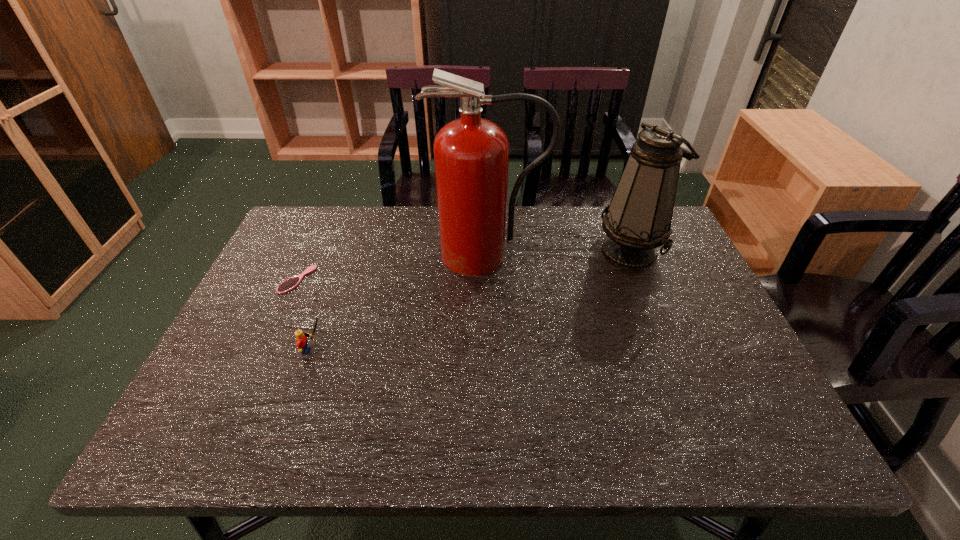
The height and width of the screenshot is (540, 960). Find the location of `vacant space that satisfies the following two spatial constraints: 1. with the handle and nozzle on the fire extinguisher; 2. on the front-facing side of the third tallest object`. vacant space that satisfies the following two spatial constraints: 1. with the handle and nozzle on the fire extinguisher; 2. on the front-facing side of the third tallest object is located at coordinates (490, 350).

Find the location of `free region that satisfies the following two spatial constraints: 1. with the handle and nozzle on the tallest object; 2. on the front-facing side of the third tallest object`. free region that satisfies the following two spatial constraints: 1. with the handle and nozzle on the tallest object; 2. on the front-facing side of the third tallest object is located at coordinates (490, 350).

Where is `free point that satisfies the following two spatial constraints: 1. on the front side of the oil lamp; 2. on the front-facing side of the nearest object`? Image resolution: width=960 pixels, height=540 pixels. free point that satisfies the following two spatial constraints: 1. on the front side of the oil lamp; 2. on the front-facing side of the nearest object is located at coordinates (672, 350).